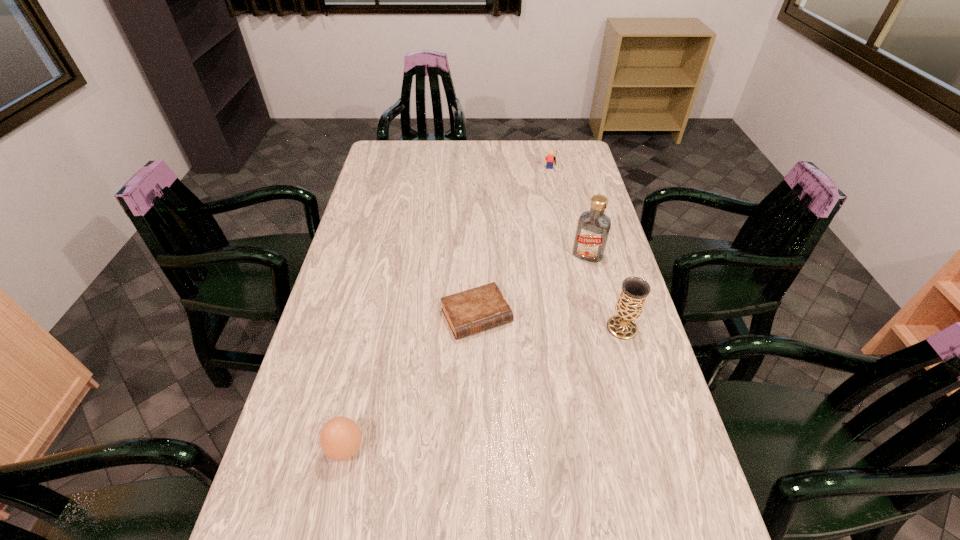
Where is `the nearest object`? the nearest object is located at coordinates (340, 438).

Image resolution: width=960 pixels, height=540 pixels. In order to click on boiled egg in this screenshot , I will do `click(340, 438)`.

Find the location of a particular element. Image resolution: width=960 pixels, height=540 pixels. the fourth shortest object is located at coordinates (634, 291).

I want to click on the shortest object, so click(482, 308).

This screenshot has width=960, height=540. Identify the location of diary. (482, 308).

Identify the location of vodka. The image size is (960, 540). (593, 227).

At what (x,y) coordinates should I click in order to perform the action: click on the second farthest object. Please return your answer as a coordinate pair (x, y). This screenshot has height=540, width=960. Looking at the image, I should click on click(x=593, y=227).

Where is `Lego`? The width and height of the screenshot is (960, 540). Lego is located at coordinates click(550, 158).

Image resolution: width=960 pixels, height=540 pixels. I want to click on free space located 0.340m on the back of the nearest object, so click(x=374, y=318).

At what (x,y) coordinates should I click in order to perform the action: click on vacant space situated 0.320m on the front of the second tallest object. Please return your answer as a coordinate pair (x, y). The height and width of the screenshot is (540, 960). Looking at the image, I should click on (660, 456).